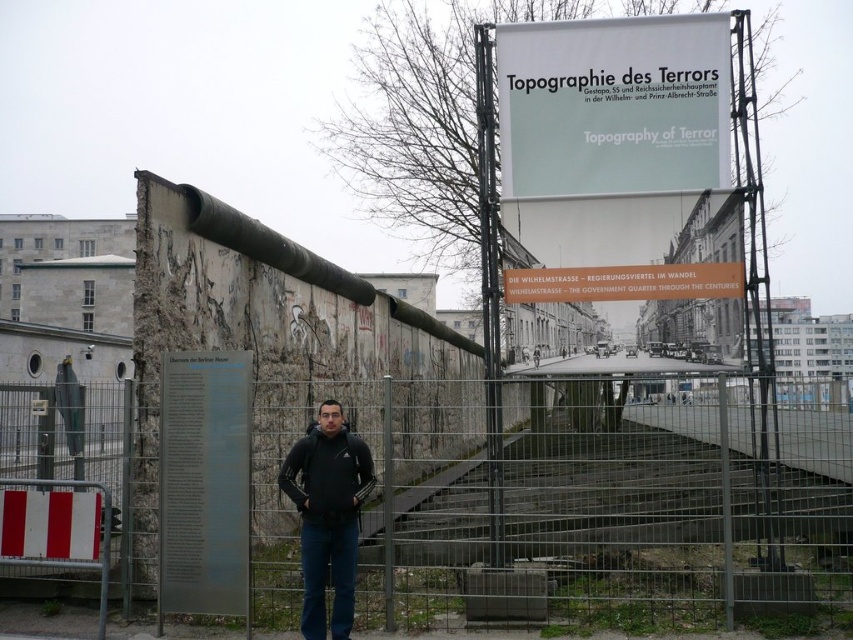
Question: Which object is closer to the camera taking this photo?

Choices:
 (A) white plastic sign at center
 (B) transparent glass information board at lower left
 (C) black matte jacket at center
 (D) white paper sign at upper center

Answer: (C)

Question: Which of the following is the closest to the observer?

Choices:
 (A) metal wire fence at center
 (B) black matte jacket at center

Answer: (B)

Question: Does metal wire fence at center appear under transparent glass information board at lower left?

Choices:
 (A) yes
 (B) no

Answer: (A)

Question: Does transparent glass information board at lower left appear under black fleece sweatshirt at center?

Choices:
 (A) no
 (B) yes

Answer: (B)

Question: Is transparent glass information board at lower left bigger than black matte jacket at center?

Choices:
 (A) yes
 (B) no

Answer: (B)

Question: Which point is farther to the camera?

Choices:
 (A) black fleece sweatshirt at center
 (B) white paper sign at upper center
 (C) transparent glass information board at lower left

Answer: (B)